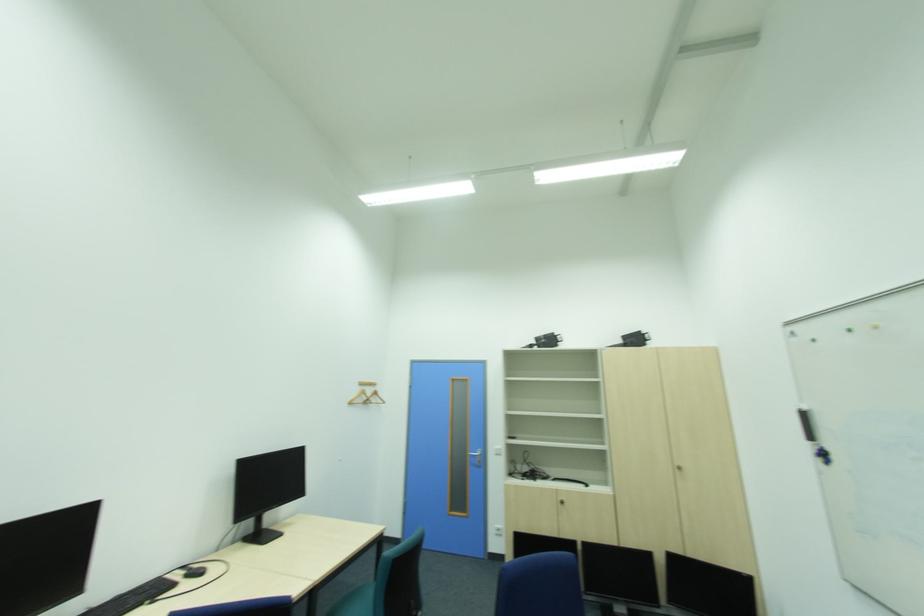
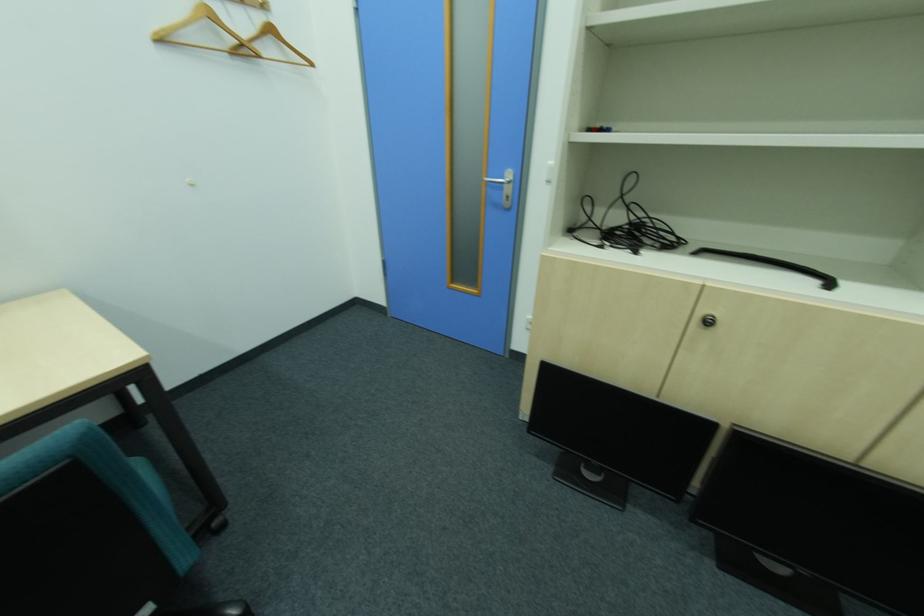
In the second image, find the point that corresponds to (375,400) in the first image.

(249, 45)